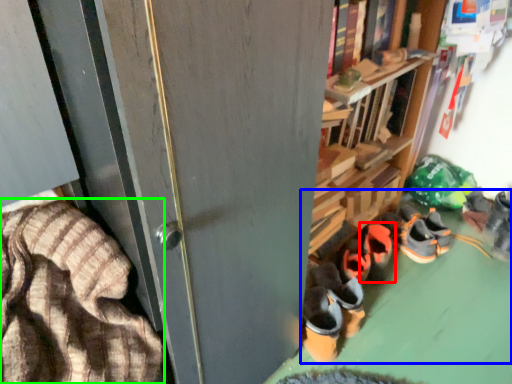
Question: Estimate the real-world distances between objects in this image. Which object is farther from footwear (highlighted by a red box), footwear (highlighted by a blue box) or blanket (highlighted by a green box)?

Choices:
 (A) footwear
 (B) blanket

Answer: (B)